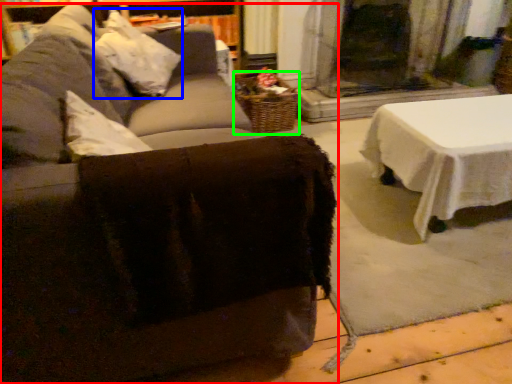
Question: Based on their relative distances, which object is farther from studio couch (highlighted by a red box)? Choose from pillow (highlighted by a blue box) and basket (highlighted by a green box).

Choices:
 (A) pillow
 (B) basket

Answer: (B)